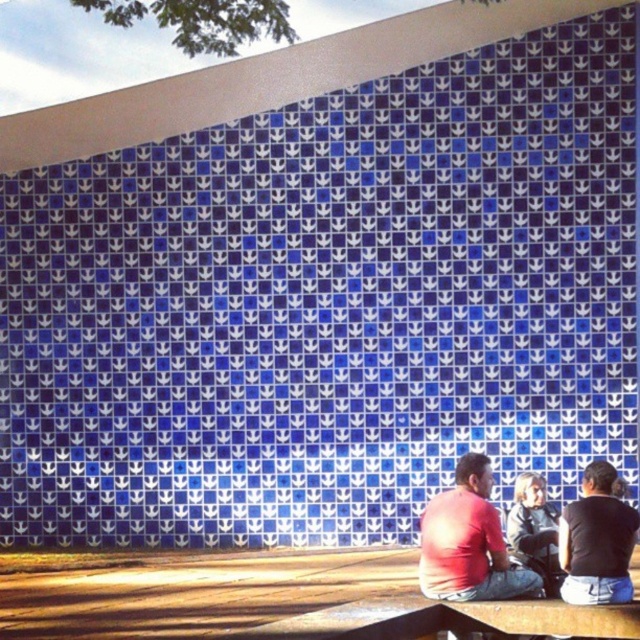
You are standing in front of the blue and white tiled wall and see two people sitting on the bench. The people are the matte red shirt at lower center and the black matte shirt at lower right. Which person is closer to you?

The matte red shirt at lower center is closer to you because it is further to the viewer than the black matte shirt at lower right.

You are standing in front of the blue and white tiled wall and see two people sitting on the bench. Which person is positioned to the left of the other? The options are the matte red shirt at lower center and the black matte shirt at lower right.

The matte red shirt at lower center is to the left of the black matte shirt at lower right.